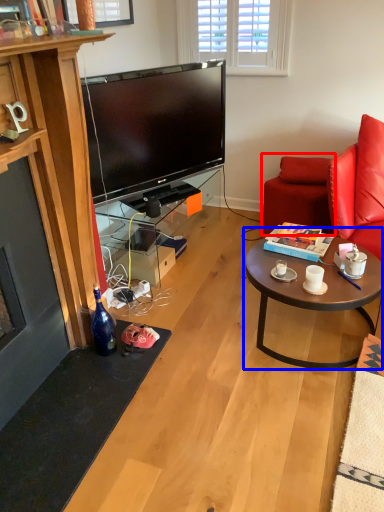
Question: Which of the following is the closest to the observer, swivel chair (highlighted by a red box) or coffee table (highlighted by a blue box)?

Choices:
 (A) swivel chair
 (B) coffee table

Answer: (B)